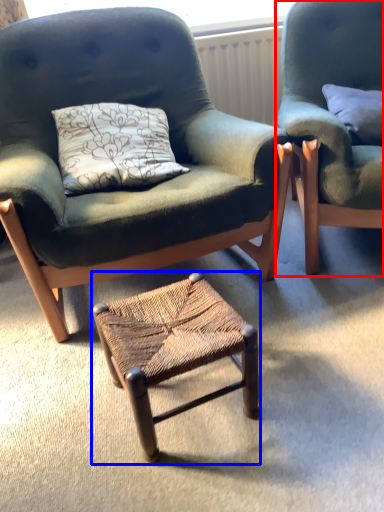
Question: Which object appears farthest to the camera in this image, chair (highlighted by a red box) or stool (highlighted by a blue box)?

Choices:
 (A) chair
 (B) stool

Answer: (A)